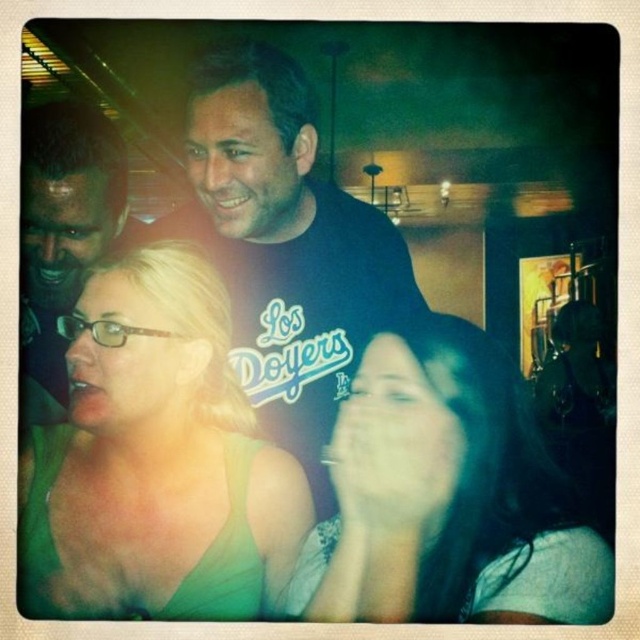
You are standing in a dimly lit bar and see the green fabric top at center. If you want to hand a drink to the person wearing it, can you reach them without moving closer than 28.86 inches?

The green fabric top at center is 28.86 inches away from the viewer, so you can reach them without moving closer than that distance.

You are at a party and want to take a photo of the green fabric top at center and the matte black shirt at upper left. Which one should you focus on if you want to capture the taller clothing item?

The matte black shirt at upper left is taller than the green fabric top at center, so focus on the matte black shirt at upper left.

Based on the scene description, where is the smooth skin face at center located in terms of coordinates?

The smooth skin face at center is located at coordinates point (445, 496).